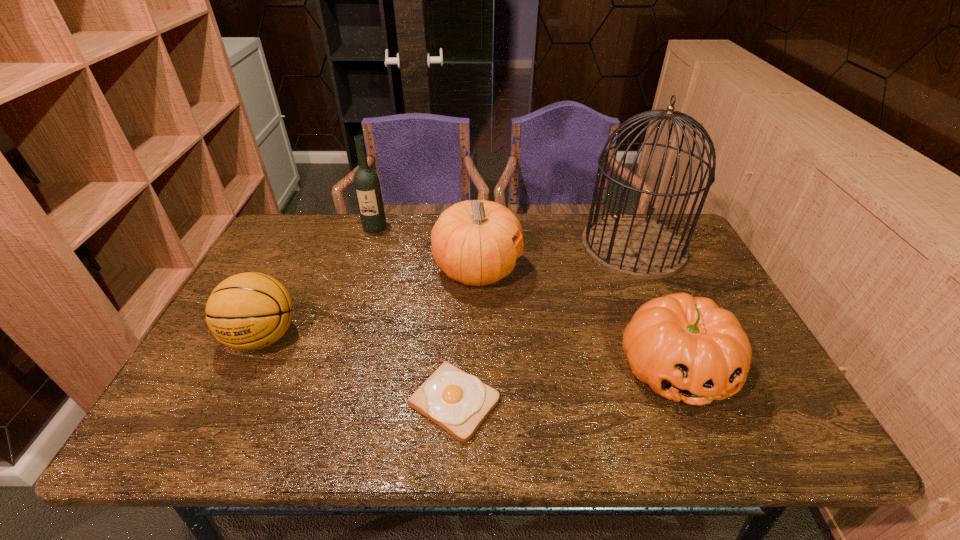
Locate an element on the screen. This screenshot has height=540, width=960. birdcage that is at the right edge is located at coordinates point(637,247).

Locate an element on the screen. pumpkin that is at the right edge is located at coordinates 686,348.

This screenshot has width=960, height=540. I want to click on object situated at the far right corner, so click(637, 247).

At what (x,y) coordinates should I click in order to perform the action: click on object located at the near right corner. Please return your answer as a coordinate pair (x, y). Image resolution: width=960 pixels, height=540 pixels. Looking at the image, I should click on (x=686, y=348).

Where is `free space at the far edge`? This screenshot has width=960, height=540. free space at the far edge is located at coordinates (412, 234).

Locate an element on the screen. vacant space at the near edge is located at coordinates (553, 435).

I want to click on vacant space at the left edge of the desktop, so click(x=228, y=369).

This screenshot has height=540, width=960. In the image, there is a desktop. Identify the location of vacant space at the right edge. (699, 280).

Locate an element on the screen. The width and height of the screenshot is (960, 540). free space at the far left corner of the desktop is located at coordinates (281, 230).

Where is `free region at the near left corner`? free region at the near left corner is located at coordinates (199, 426).